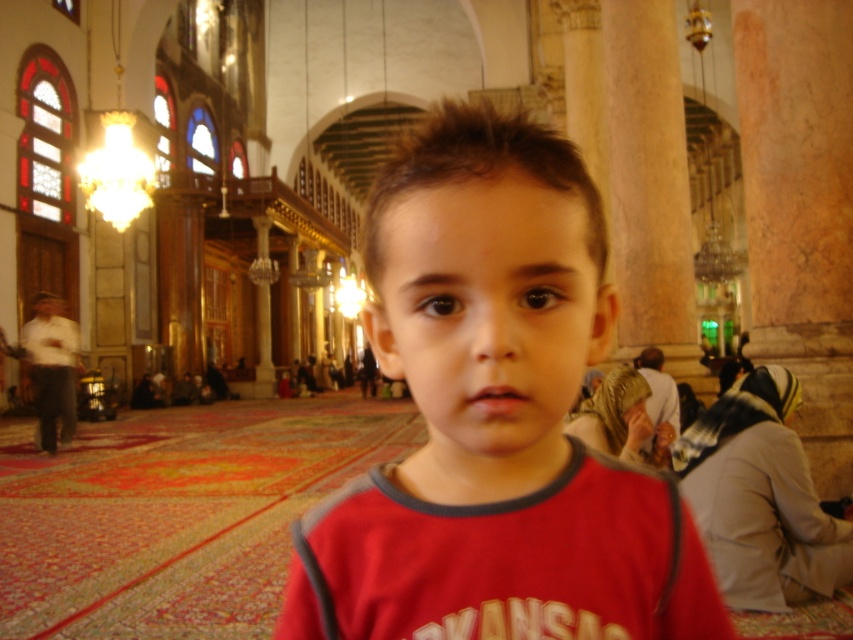
Question: In this image, where is red matte shirt at center located relative to brown matte face at center?

Choices:
 (A) below
 (B) above

Answer: (A)

Question: Is red matte shirt at center below brown matte face at center?

Choices:
 (A) no
 (B) yes

Answer: (B)

Question: Which of the following is the farthest from the observer?

Choices:
 (A) pos(477,316)
 (B) pos(378,518)

Answer: (B)

Question: Which object appears closest to the camera in this image?

Choices:
 (A) red matte shirt at center
 (B) brown matte face at center

Answer: (B)

Question: Is red matte shirt at center positioned at the back of brown matte face at center?

Choices:
 (A) no
 (B) yes

Answer: (B)

Question: Which object appears farthest from the camera in this image?

Choices:
 (A) brown matte face at center
 (B) red matte shirt at center

Answer: (B)